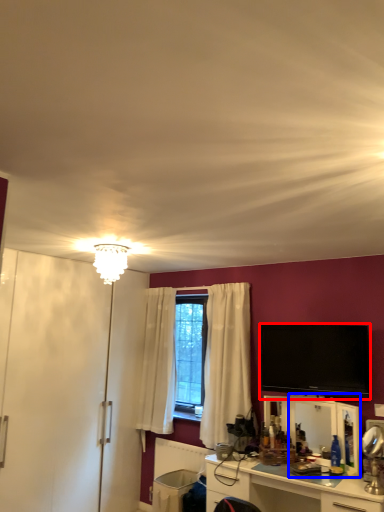
Question: Among these objects, which one is farthest to the camera, television (highlighted by a red box) or mirror (highlighted by a blue box)?

Choices:
 (A) television
 (B) mirror

Answer: (A)